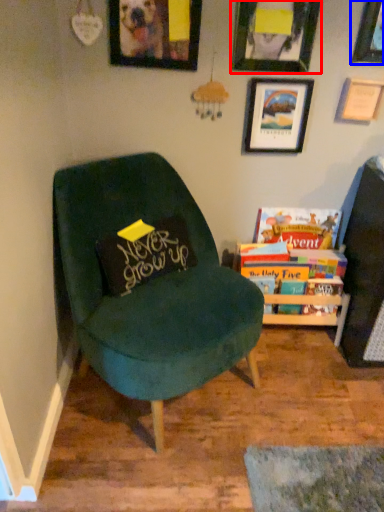
Question: Which object appears farthest to the camera in this image, picture frame (highlighted by a red box) or picture frame (highlighted by a blue box)?

Choices:
 (A) picture frame
 (B) picture frame

Answer: (B)